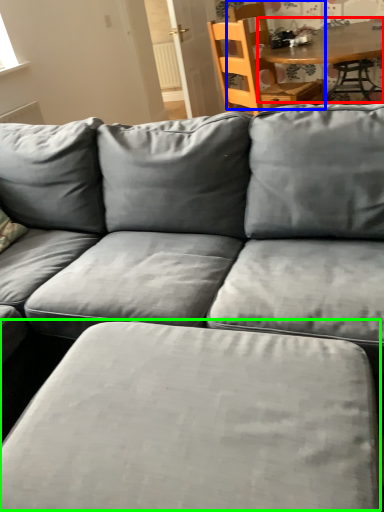
Question: Which object is the farthest from table (highlighted by a red box)? Choose among these: chair (highlighted by a blue box) or swivel chair (highlighted by a green box).

Choices:
 (A) chair
 (B) swivel chair

Answer: (B)